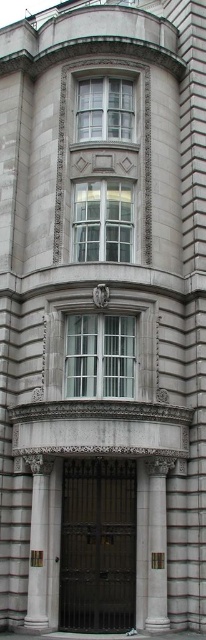
Question: Which is nearer to the satin gold metal at center?

Choices:
 (A) white marble pillar at lower left
 (B) dark brown metal gate at center

Answer: (B)

Question: Can you confirm if dark brown metal gate at center is smaller than satin gold metal at center?

Choices:
 (A) no
 (B) yes

Answer: (A)

Question: Can you confirm if white marble pillar at lower left is wider than satin gold metal at center?

Choices:
 (A) yes
 (B) no

Answer: (A)

Question: Which object is the closest to the white marble pillar at lower left?

Choices:
 (A) dark brown metal gate at center
 (B) satin gold metal at center

Answer: (A)

Question: Based on their relative distances, which object is farther from the dark brown metal gate at center?

Choices:
 (A) white marble pillar at lower left
 (B) satin gold metal at center

Answer: (B)

Question: From the image, what is the correct spatial relationship of dark brown metal gate at center in relation to satin gold metal at center?

Choices:
 (A) above
 (B) below

Answer: (B)